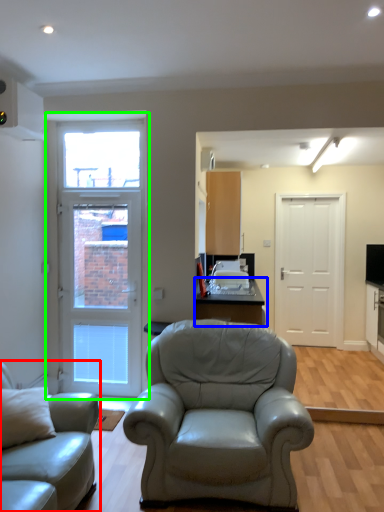
Question: Considering the real-world distances, which object is farthest from studio couch (highlighted by a red box)? table (highlighted by a blue box) or door (highlighted by a green box)?

Choices:
 (A) table
 (B) door

Answer: (B)